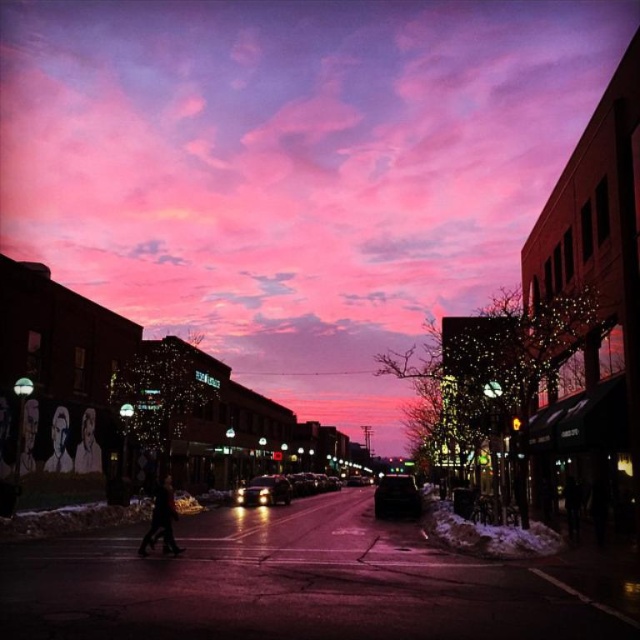
You are standing on the street and want to take a photo that includes both point (x=81, y=464) and point (x=29, y=426). Which point should you focus on first to ensure both are in focus?

You should focus on point (x=29, y=426) first because it is closer to you than point (x=81, y=464), which is further away. By focusing on the closer point, the further point will also be in focus due to depth of field.

You are standing on the street and want to take a photo that includes both the point at (x=378, y=493) and the point at (x=26, y=417). Which point should you focus on to ensure both are in sharp focus?

You should focus on the point that is closer to you, which is point (x=26, y=417), because it is nearer than point (x=378, y=493). This way, the depth of field will likely cover both points, ensuring they are both in focus.